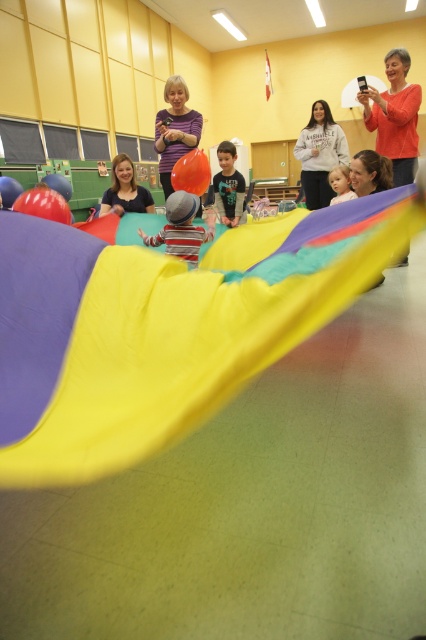
You are a photographer positioned at the back of the gymnasium. You want to take a photo that clearly shows both the matte striped shirt at center and the rubber balloon at center. Which object should you focus on first to ensure both are in focus?

You should focus on the matte striped shirt at center first since it is closer to the viewer than the rubber balloon at center. By focusing on the closer object, the balloon will still be within the depth of field, ensuring both are in focus.

You are organizing a party and need to choose between the rubberized orange balloon at center and the rubber balloon at center for a decoration that requires a larger size. Which one should you pick?

The rubberized orange balloon at center has a larger width than the rubber balloon at center, so you should pick the rubberized orange balloon at center for the decoration that requires a larger size.